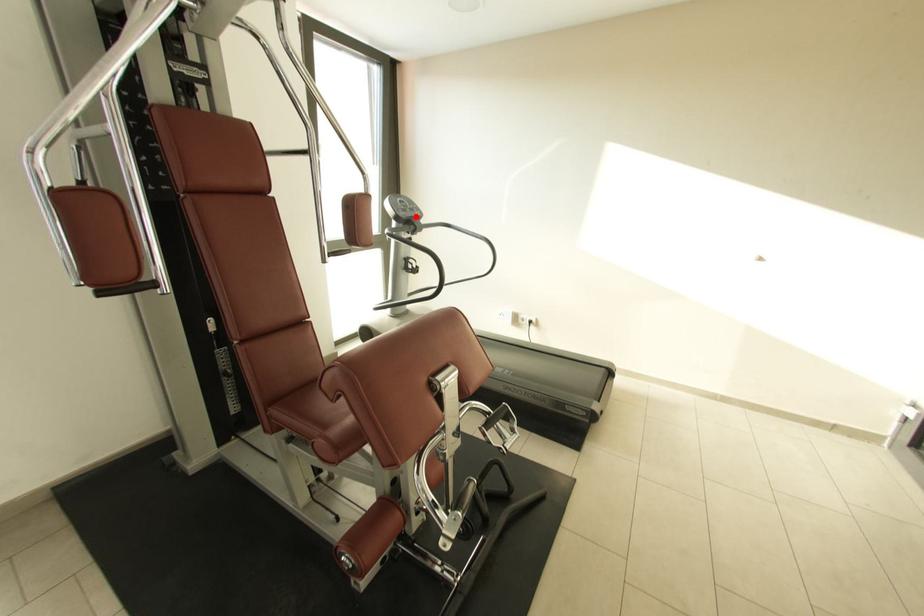
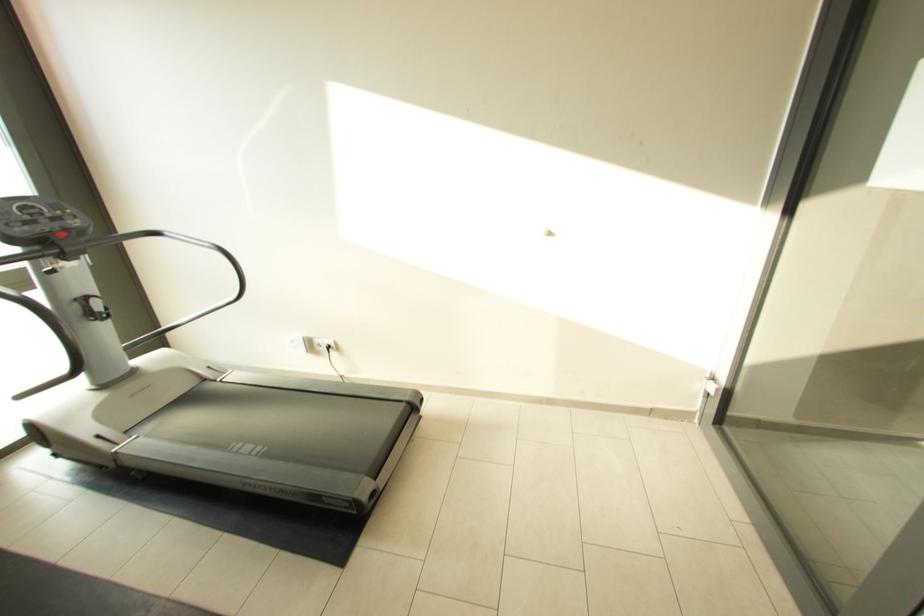
Question: I am providing you with two images of the same scene from different viewpoints. Given a red point in image1, look at the same physical point in image2. Is it:

Choices:
 (A) Closer to the viewpoint
 (B) Farther from the viewpoint

Answer: (B)